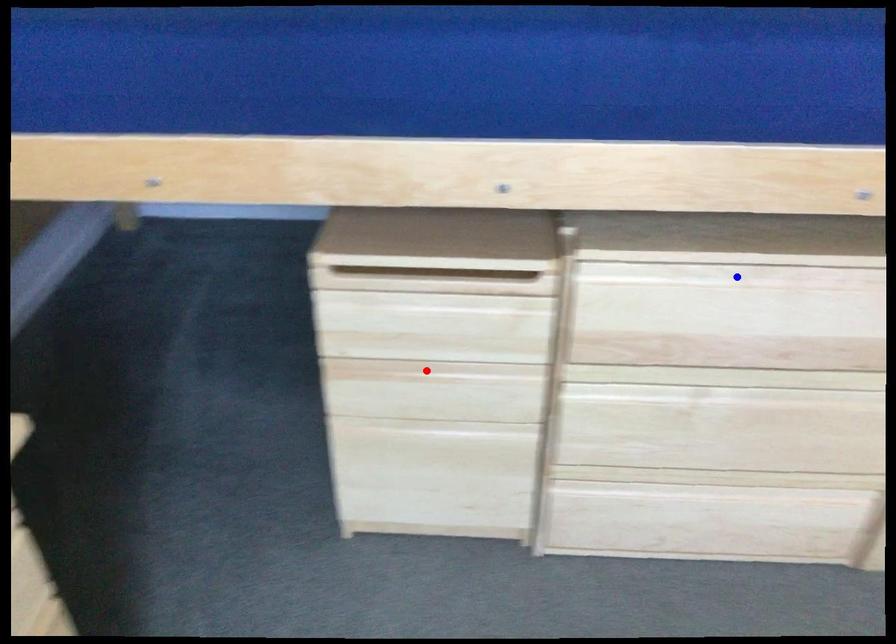
Question: Two points are marked on the image. Which point is closer to the camera?

Choices:
 (A) Blue point is closer.
 (B) Red point is closer.

Answer: (A)